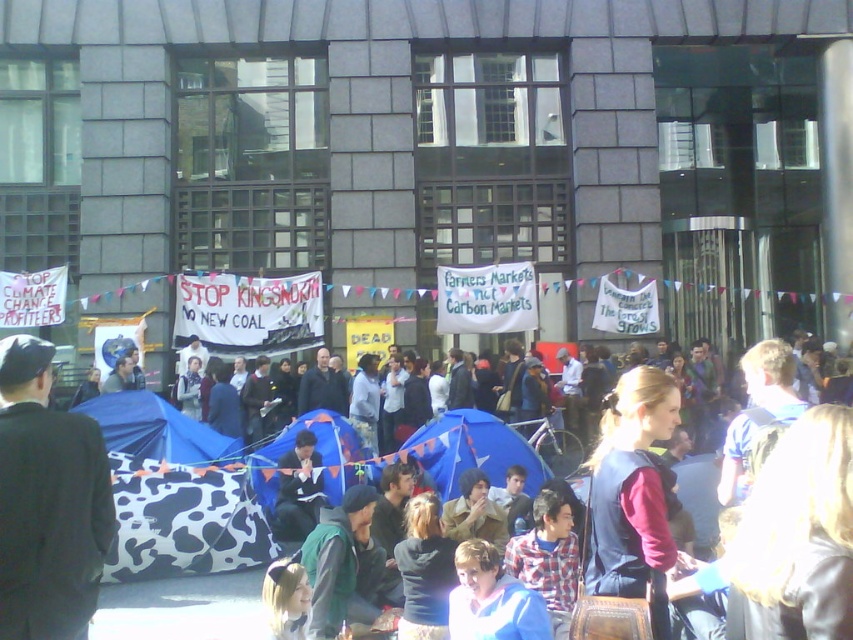
You are a photographer standing at the front of the protest scene. You want to take a photo that includes both the point at (219, 454) and the point at (293, 506). Which point should be placed closer to the front of the photo to ensure both are in focus?

Point (219, 454) is closer to the camera than point (293, 506), so to ensure both are in focus, place the point at (219, 454) closer to the front of the photo.

Consider the image. You are a photographer trying to capture the protest scene. You want to ensure that the blue fabric tent at center and the dark blue fabric at center are both visible in your photo. Based on their positions, which object should you focus on to include both in the frame?

The blue fabric tent at center is positioned over the dark blue fabric at center, so focusing on the blue fabric tent at center would allow both objects to be visible in the photo.